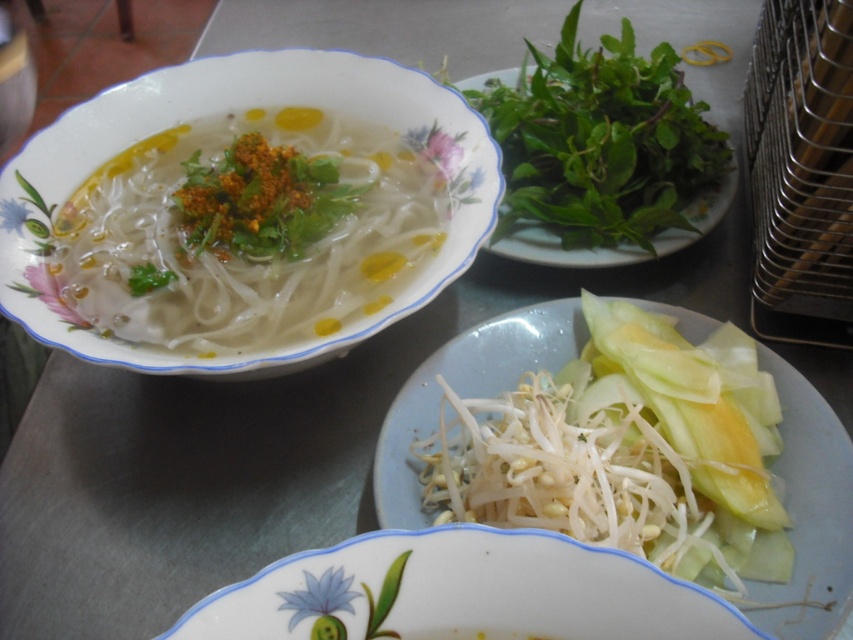
Question: Can you confirm if green leafy at upper right is smaller than white translucent noodles at lower center?

Choices:
 (A) yes
 (B) no

Answer: (B)

Question: Does white translucent bean sprouts at lower center appear over green leafy at upper right?

Choices:
 (A) no
 (B) yes

Answer: (A)

Question: Does translucent noodles at center appear on the left side of green leafy at upper right?

Choices:
 (A) yes
 (B) no

Answer: (A)

Question: Which point is closer to the camera?

Choices:
 (A) 453,497
 (B) 171,189

Answer: (A)

Question: Which point is closer to the camera taking this photo?

Choices:
 (A) (363, 266)
 (B) (527, 225)
 (C) (752, 576)
 (D) (625, 547)

Answer: (D)

Question: Which of the following is the farthest from the observer?

Choices:
 (A) (270, 348)
 (B) (590, 422)
 (C) (532, 112)

Answer: (C)